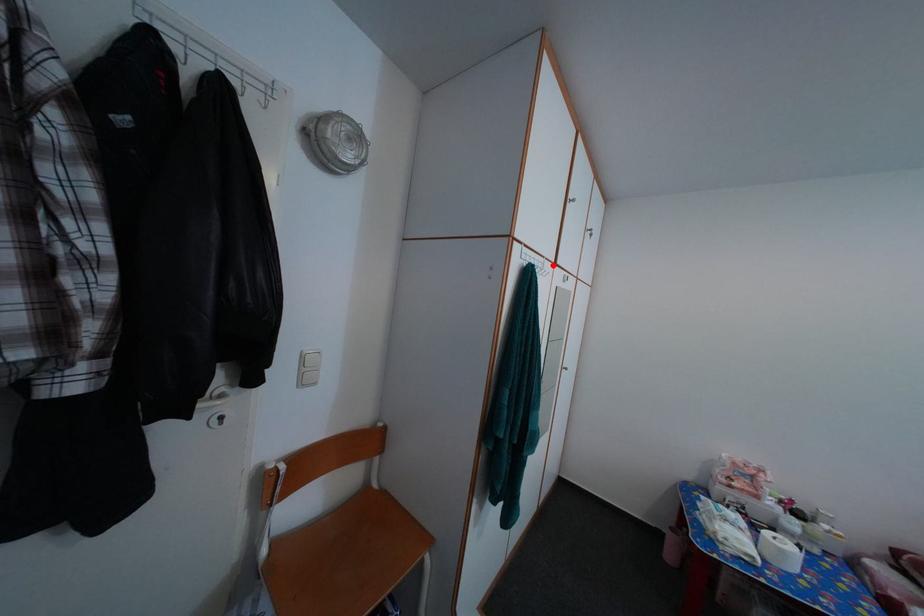
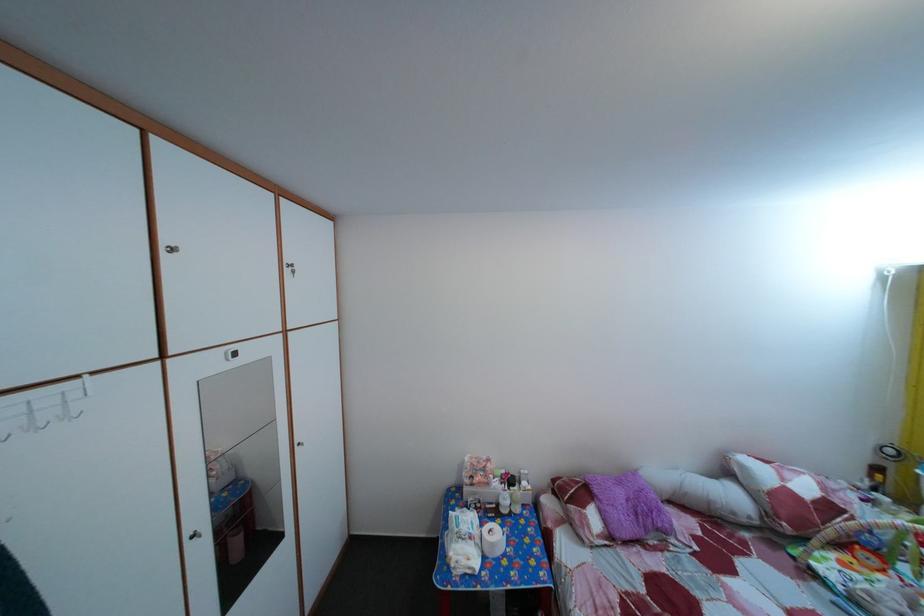
Locate, in the second image, the point that corresponds to the highlighted location in the first image.

(86, 384)